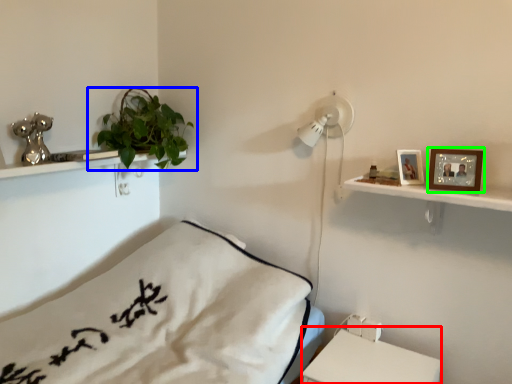
Question: Which object is the closest to the table (highlighted by a red box)? Choose among these: houseplant (highlighted by a blue box) or picture frame (highlighted by a green box).

Choices:
 (A) houseplant
 (B) picture frame

Answer: (B)